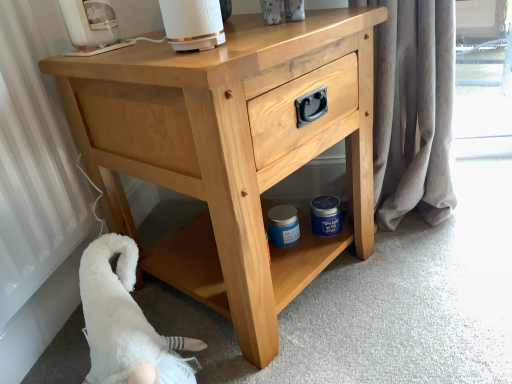
This screenshot has width=512, height=384. Find the location of `unoccupied region to the right of natural wood chest of drawers at center`. unoccupied region to the right of natural wood chest of drawers at center is located at coordinates (433, 268).